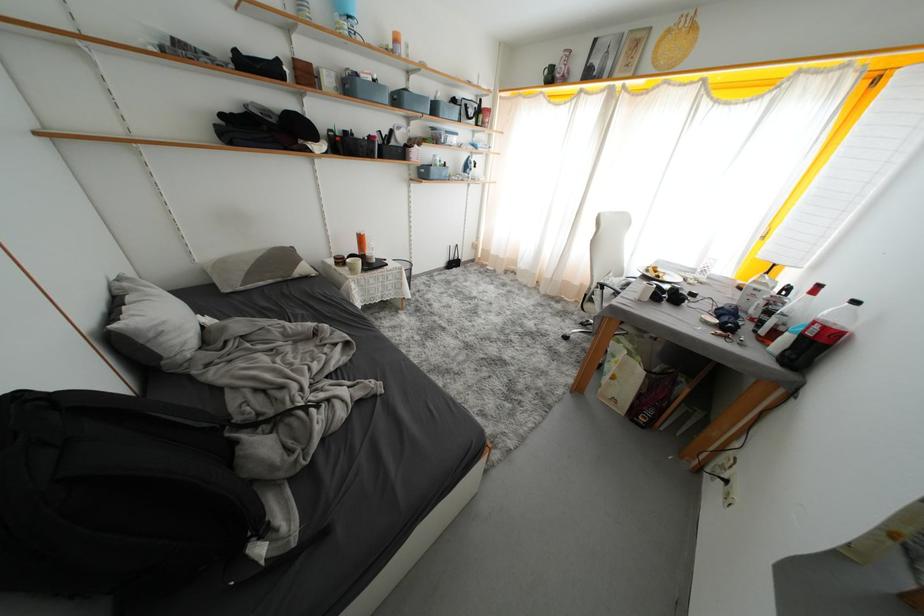
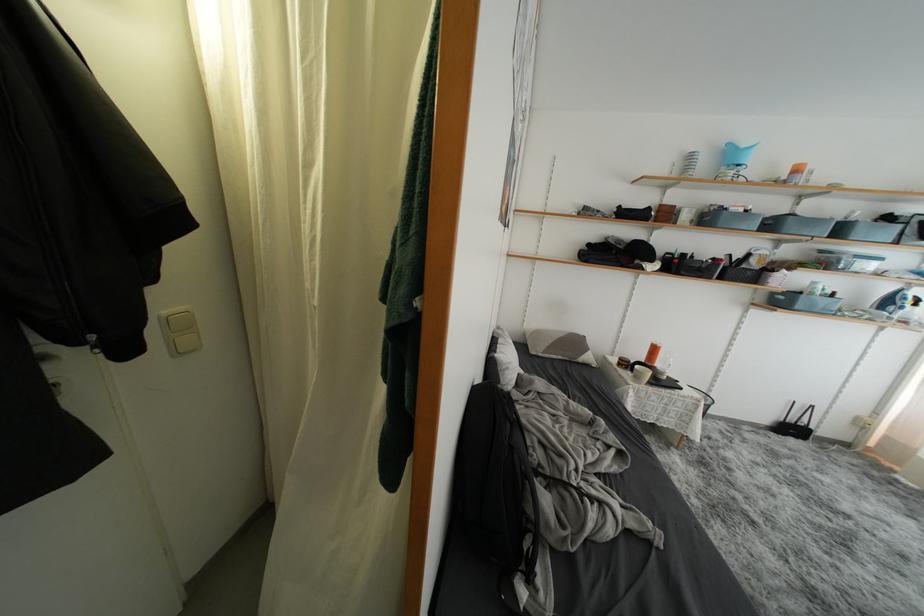
Locate, in the second image, the point that corresponds to the point at 359,275 in the first image.

(642, 382)